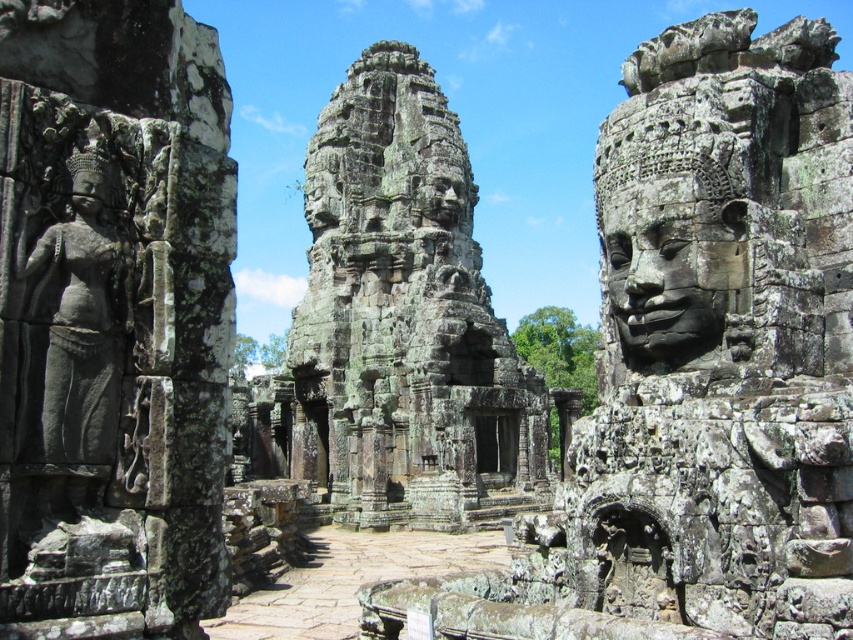
Does rough stone temple at center come behind gray stone statue at left?

Yes.

Which is below, rough stone temple at center or gray stone statue at left?

gray stone statue at left is lower down.

Does point (299, 358) come behind point (88, 339)?

Yes, point (299, 358) is behind point (88, 339).

Identify the location of rough stone temple at center. The image size is (853, 640). (399, 324).

Does carved stone face at right have a larger size compared to matte stone face at left?

Actually, carved stone face at right might be smaller than matte stone face at left.

Between carved stone face at right and matte stone face at left, which one is positioned lower?

carved stone face at right is below.

Where is `carved stone face at right`? carved stone face at right is located at coordinates (670, 276).

Who is more forward, (105, 180) or (74, 168)?

Point (74, 168)

Who is positioned more to the right, dark gray stone head at left or matte stone face at left?

From the viewer's perspective, dark gray stone head at left appears more on the right side.

Locate an element on the screen. dark gray stone head at left is located at coordinates (94, 180).